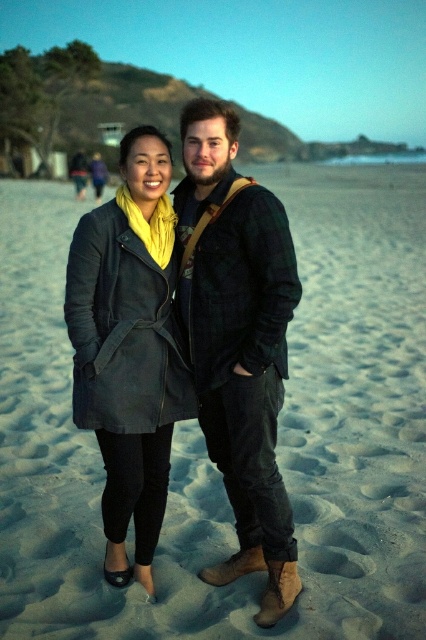
You are a photographer trying to capture a photo of the sandy beach at center and the flannel shirt at center. Which object should you zoom in on to ensure both are clearly visible in the frame?

The sandy beach at center is larger in size than the flannel shirt at center, so you should zoom in on the flannel shirt at center to ensure both are clearly visible in the frame.

You are standing at the camera position and want to reach the point marked at coordinates [365,404]. If you walk straight ahead, will you reach that point before or after passing the two people on the beach?

The point marked at coordinates [365,404] is 21.16 feet away from the camera. Since the two people are on the beach in the foreground, you would reach the point before passing them.